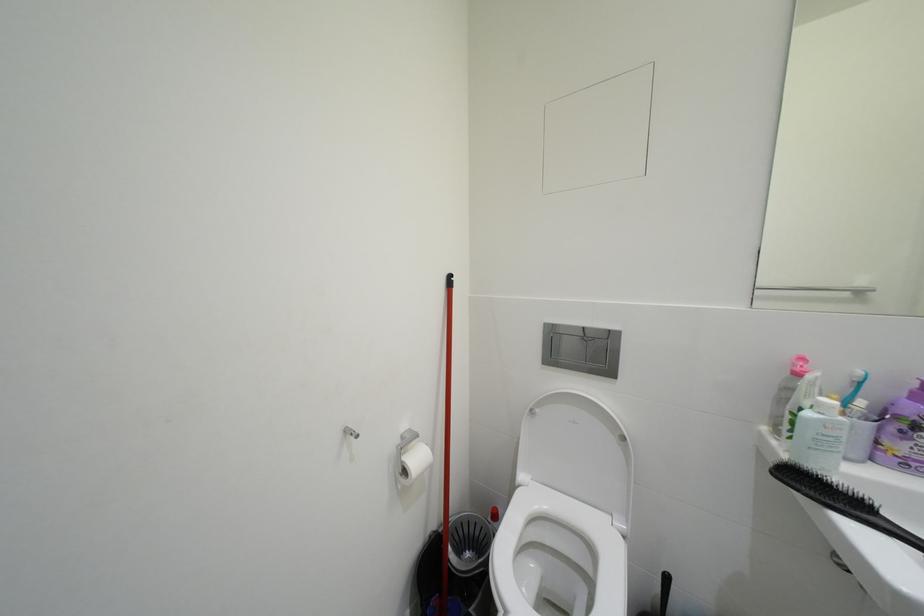
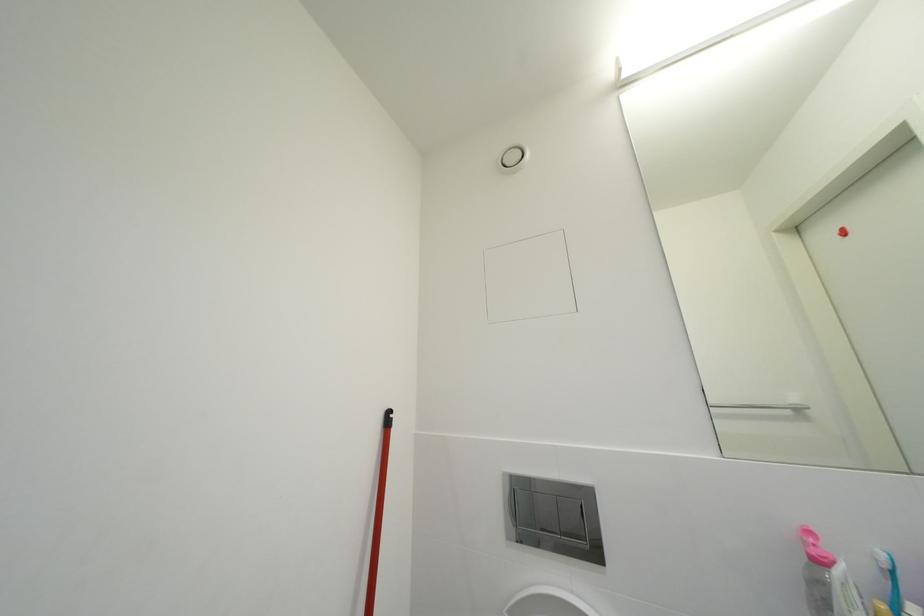
Question: The images are taken continuously from a first-person perspective. In which direction is your viewpoint rotating?

Choices:
 (A) Left
 (B) Right
 (C) Up
 (D) Down

Answer: (C)